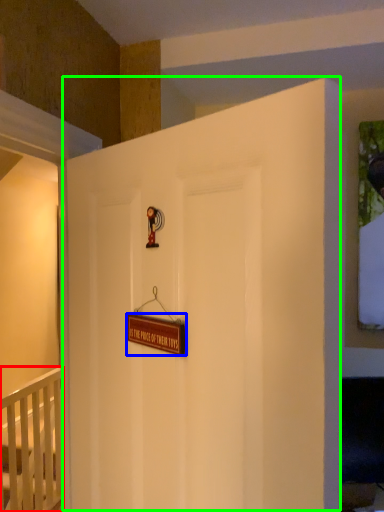
Question: Which is nearer to the infant bed (highlighted by a red box)? plaque (highlighted by a blue box) or door (highlighted by a green box).

Choices:
 (A) plaque
 (B) door

Answer: (B)